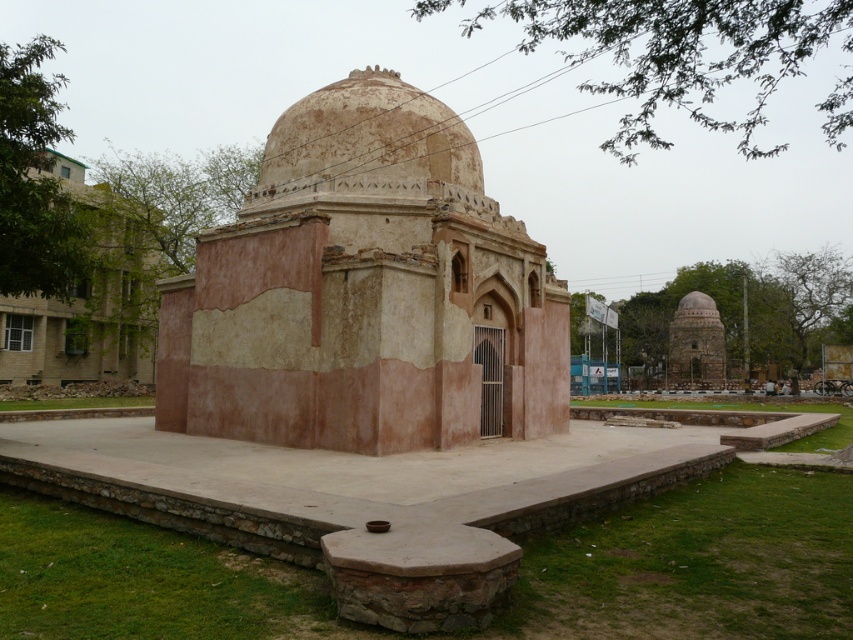
Question: Which point appears closest to the camera in this image?

Choices:
 (A) (109, 282)
 (B) (409, 99)
 (C) (302, 435)

Answer: (C)

Question: Is rustic stone dome at center in front of beige stone dome at center?

Choices:
 (A) no
 (B) yes

Answer: (A)

Question: Can you confirm if rustic stone dome at center is positioned above brown textured dome at center?

Choices:
 (A) yes
 (B) no

Answer: (B)

Question: Does beige stone dome at center appear on the right side of brown textured dome at center?

Choices:
 (A) yes
 (B) no

Answer: (B)

Question: Which object is closer to the camera taking this photo?

Choices:
 (A) beige stone dome at center
 (B) rustic stone dome at center

Answer: (A)

Question: Which point is farther to the camera?

Choices:
 (A) (59, 344)
 (B) (328, 234)
 (C) (440, 161)

Answer: (A)